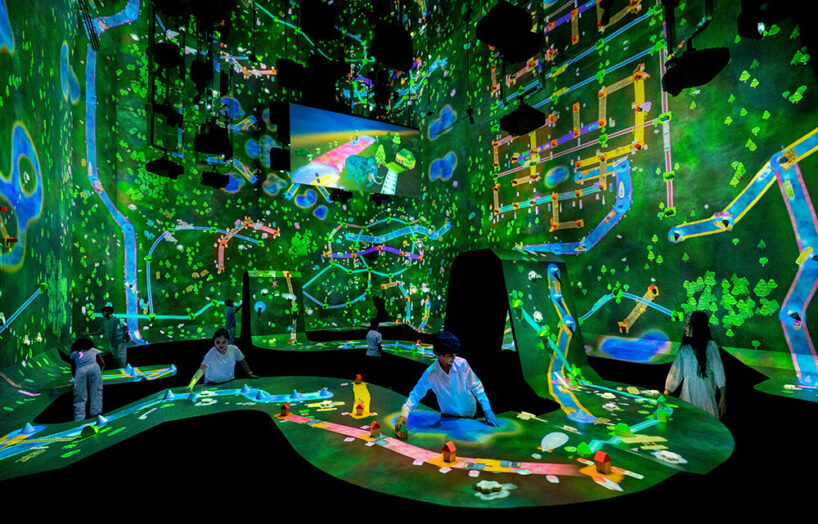
Find the location of `table`. table is located at coordinates (339, 447).